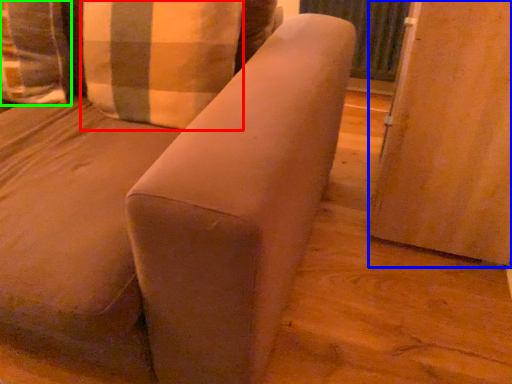
Question: Considering the real-world distances, which object is closest to pillow (highlighted by a red box)? screen door (highlighted by a blue box) or pillow (highlighted by a green box).

Choices:
 (A) screen door
 (B) pillow

Answer: (B)